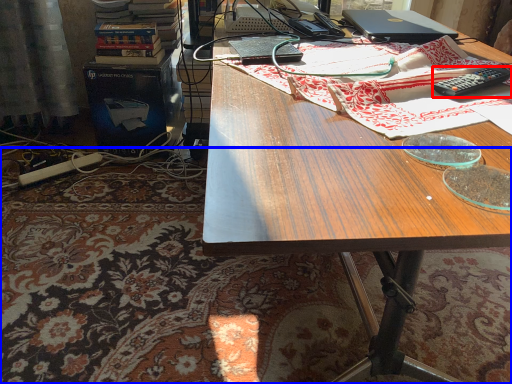
Question: Which point is further to the camera, remote control (highlighted by a red box) or mat (highlighted by a blue box)?

Choices:
 (A) remote control
 (B) mat

Answer: (B)